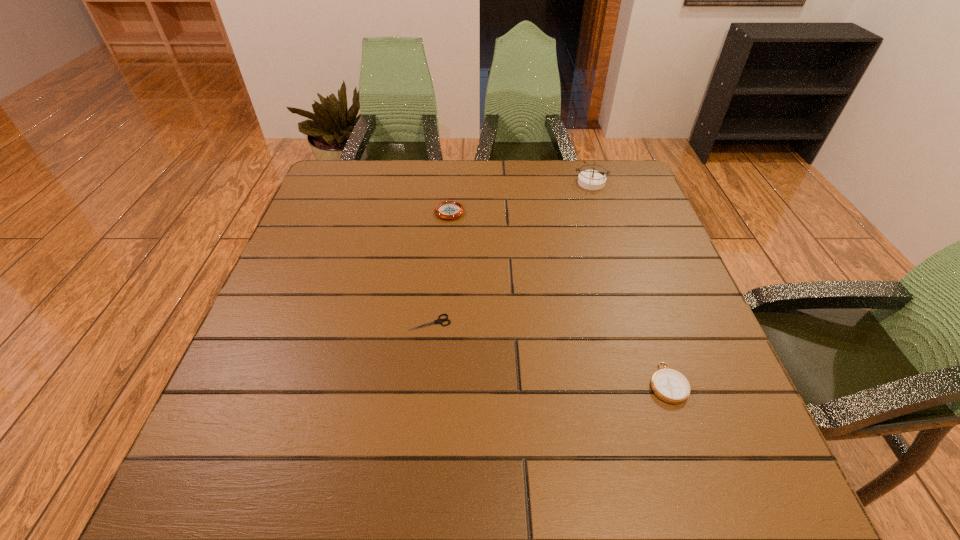
You are a GUI agent. You are given a task and a screenshot of the screen. Output one action in this format:
    pyautogui.click(x=<x>, y=<y>)
    Task: Click on the unoccupied area between the leftmost compass and the shears
    This screenshot has height=540, width=960.
    Given the screenshot: What is the action you would take?
    pyautogui.click(x=440, y=267)

The image size is (960, 540). What are the coordinates of `unoccupied position between the shortest object and the leftmost compass` in the screenshot? It's located at (440, 267).

This screenshot has width=960, height=540. I want to click on empty space between the nearest compass and the shears, so click(549, 353).

Where is `free space between the nearest compass and the shears`? The image size is (960, 540). free space between the nearest compass and the shears is located at coordinates (549, 353).

The height and width of the screenshot is (540, 960). Find the location of `vacant space that's between the farthest compass and the shears`. vacant space that's between the farthest compass and the shears is located at coordinates (511, 252).

Image resolution: width=960 pixels, height=540 pixels. Find the location of `vacant space in between the nearest object and the shears`. vacant space in between the nearest object and the shears is located at coordinates (549, 353).

You are a GUI agent. You are given a task and a screenshot of the screen. Output one action in this format:
    pyautogui.click(x=<x>, y=<y>)
    Task: Click on the empty location between the tallest object and the shears
    This screenshot has height=540, width=960.
    Given the screenshot: What is the action you would take?
    pyautogui.click(x=511, y=252)

Point out which object is positioned as the second nearest to the farthest compass. Please provide its 2D coordinates. Your answer should be formatted as a tuple, i.e. [(x, y)], where the tuple contains the x and y coordinates of a point satisfying the conditions above.

[(439, 321)]

Identify the location of object that is the third closest to the tallest compass. (669, 385).

Identify which compass is the second nearest to the shortest object. Please provide its 2D coordinates. Your answer should be formatted as a tuple, i.e. [(x, y)], where the tuple contains the x and y coordinates of a point satisfying the conditions above.

[(669, 385)]